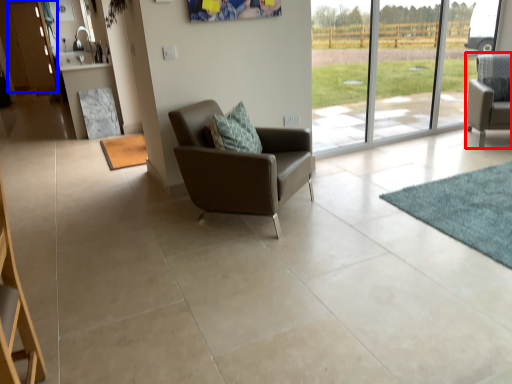
Question: Which object appears closest to the camera in this image, chair (highlighted by a red box) or screen door (highlighted by a blue box)?

Choices:
 (A) chair
 (B) screen door

Answer: (A)